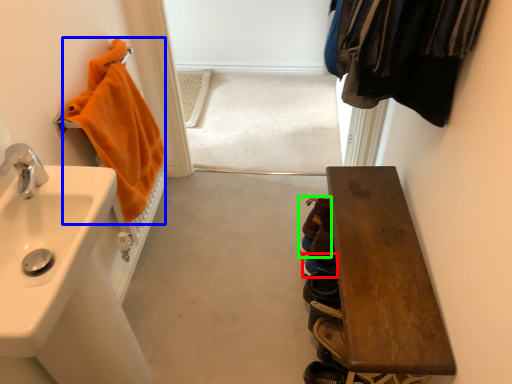
Question: Estimate the real-world distances between objects in this image. Which object is closer to shoe (highlighted by a red box), bath towel (highlighted by a blue box) or shoe (highlighted by a green box)?

Choices:
 (A) bath towel
 (B) shoe

Answer: (B)